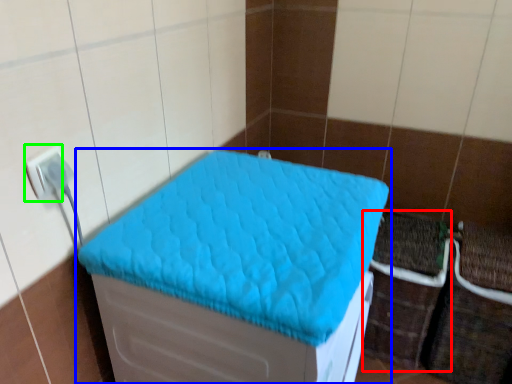
Question: Which is farther away from crate (highlighted by a red box)? furniture (highlighted by a blue box) or electric outlet (highlighted by a green box)?

Choices:
 (A) furniture
 (B) electric outlet

Answer: (B)